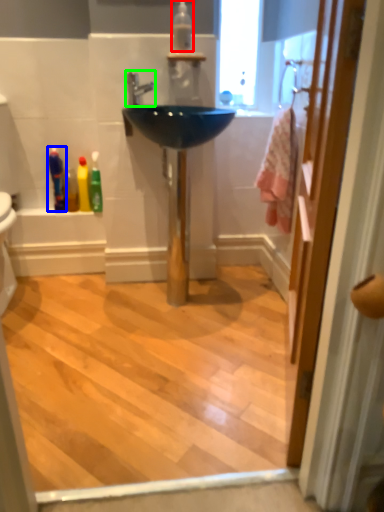
Question: Considering the real-world distances, which object is closest to mouthwash (highlighted by a red box)? toiletry (highlighted by a blue box) or tap (highlighted by a green box).

Choices:
 (A) toiletry
 (B) tap

Answer: (B)